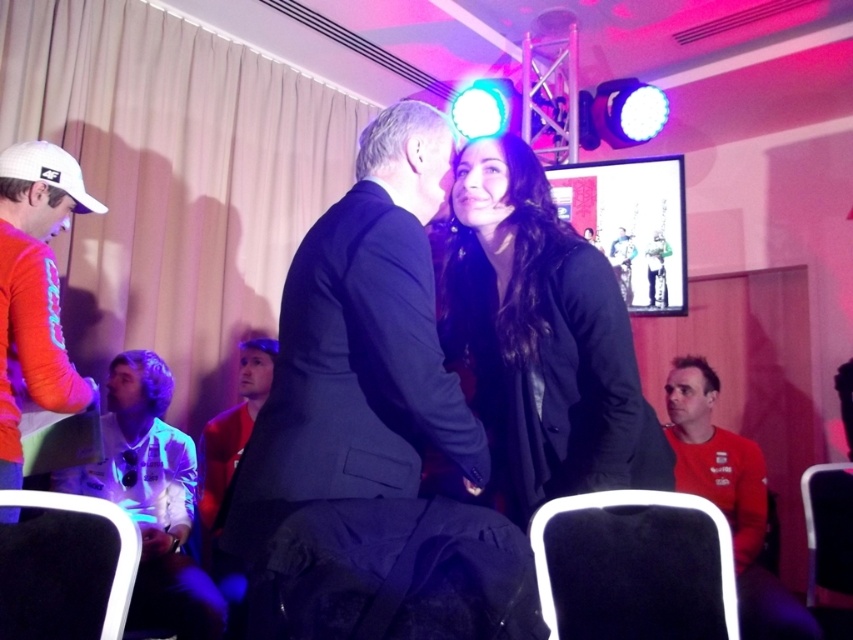
Question: Which object appears farthest from the camera in this image?

Choices:
 (A) red matte shirt at lower right
 (B) orange fabric shirt at left
 (C) dark gray suit at center

Answer: (A)

Question: Can you confirm if black leather jacket at center is positioned to the left of orange fabric shirt at left?

Choices:
 (A) no
 (B) yes

Answer: (A)

Question: Can you confirm if white glossy shirt at lower left is positioned to the right of orange fabric shirt at left?

Choices:
 (A) no
 (B) yes

Answer: (A)

Question: Does black leather jacket at center appear under orange fabric shirt at left?

Choices:
 (A) no
 (B) yes

Answer: (B)

Question: Which of these objects is positioned farthest from the dark gray suit at center?

Choices:
 (A) red matte shirt at lower right
 (B) orange fabric shirt at left
 (C) white glossy shirt at lower left

Answer: (C)

Question: Which object appears farthest from the camera in this image?

Choices:
 (A) white glossy shirt at lower left
 (B) black leather jacket at center

Answer: (A)